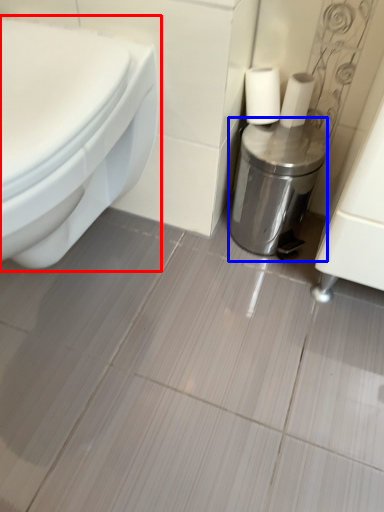
Question: Which of the following is the farthest to the observer, toilet (highlighted by a red box) or dispenser (highlighted by a blue box)?

Choices:
 (A) toilet
 (B) dispenser

Answer: (B)